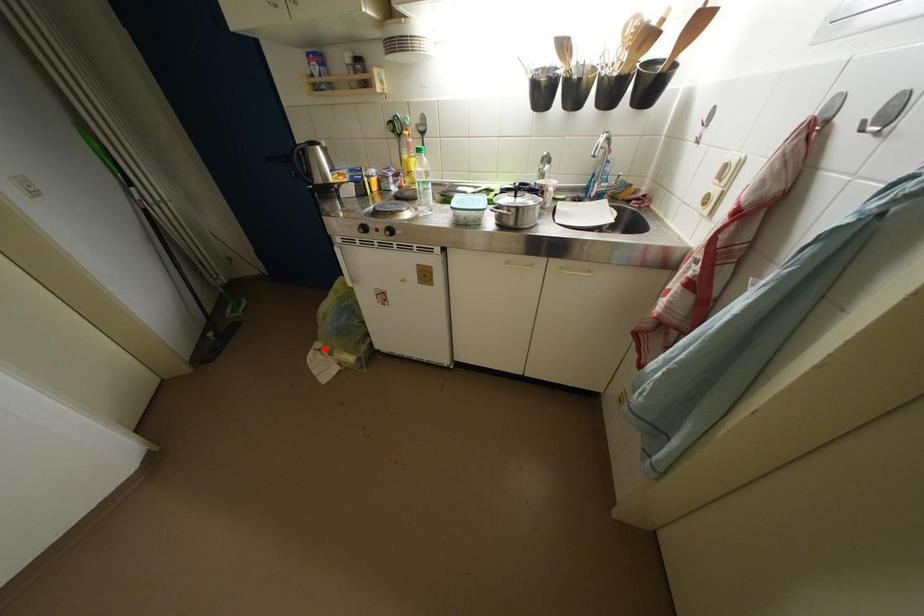
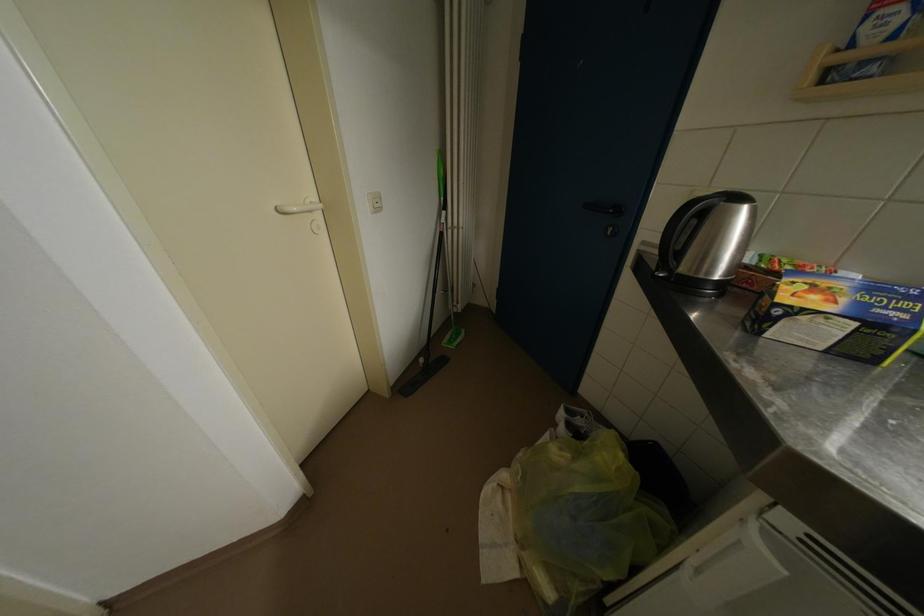
Where in the second image is the point corresponding to the highlighted location from the first image?

(511, 480)